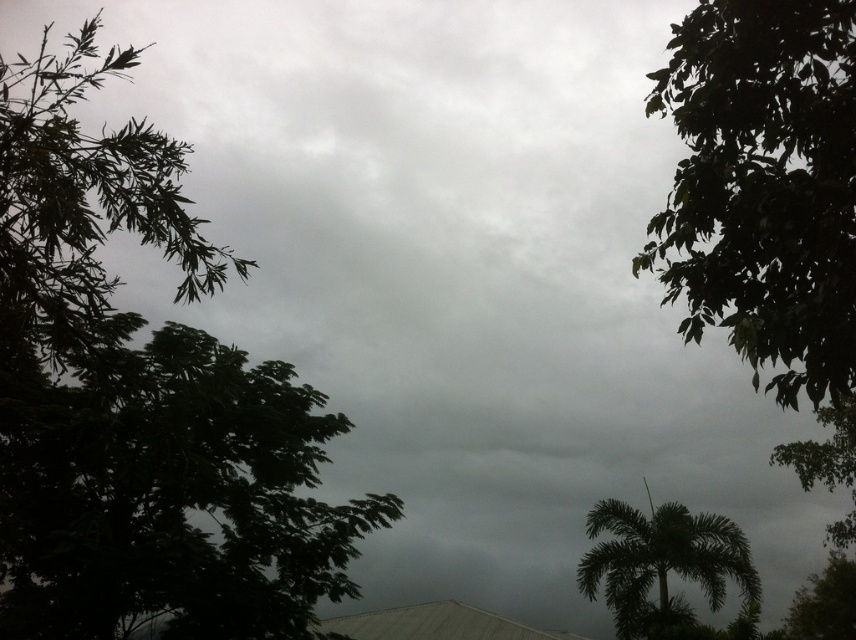
You are an observer looking at the image. You notice the green leafy tree at left and the green leafy palm tree at lower right. Which tree is closer to the top of the image?

The green leafy tree at left is positioned over the green leafy palm tree at lower right, so it is closer to the top of the image.